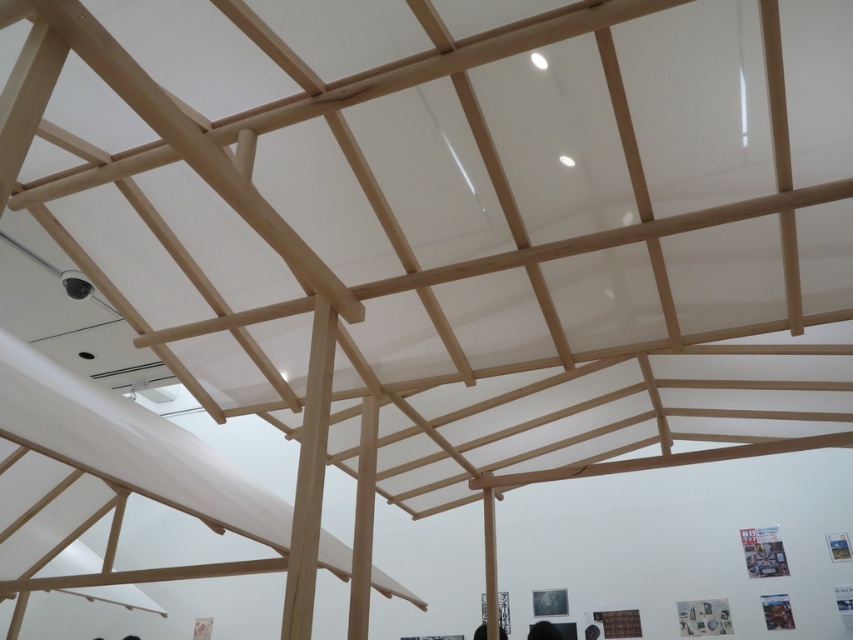
You are standing in the room and want to place a small decorative item exactly at the position where the black hair at lower center is located. What are the coordinates of that position?

The coordinates of the position where the black hair at lower center is located are at point [543,630].

You are a photographer standing in the room and want to capture the black hair at lower center marked by point (543, 630). Given that your camera has a 50mm lens with a field of view of 46 degrees, will the entire ceiling with its wooden beams be visible in the photo if you center your view on the black hair at lower center?

The point (543, 630) marks the black hair at lower center. Since the ceiling with wooden beams is at the top of the image and the black hair is at lower center, centering the camera on the black hair at lower center would likely exclude the ceiling from the frame. The 50mm lens with a 46 degree field of view may not capture the entire ceiling if the camera is pointed downward towards the lower center. Therefore, the entire ceiling with wooden beams might not be visible.